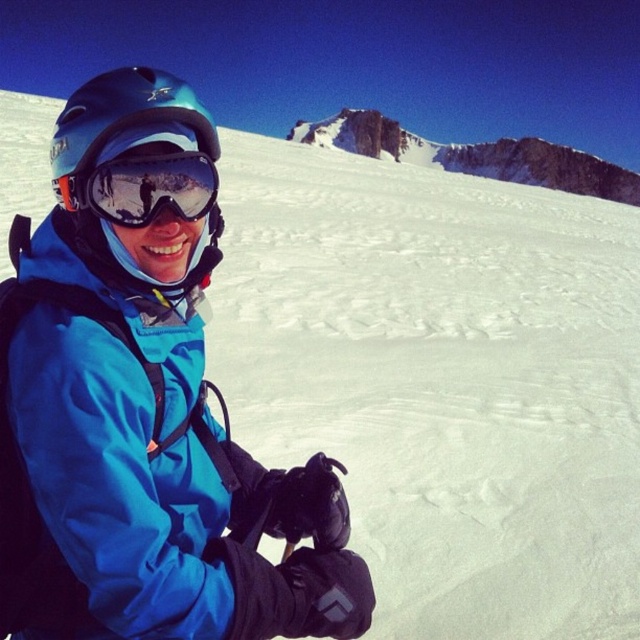
Which is in front, point (368, 132) or point (76, 179)?

Positioned in front is point (76, 179).

Is rugged stone mountain at upper center further to the viewer compared to glossy reflective goggles at center?

Yes, rugged stone mountain at upper center is behind glossy reflective goggles at center.

Is point (557, 173) closer to camera compared to point (83, 188)?

No, (557, 173) is behind (83, 188).

Where is `rugged stone mountain at upper center`? rugged stone mountain at upper center is located at coordinates (474, 156).

Can you confirm if rugged stone mountain at upper center is positioned to the left of matte blue helmet at left?

Incorrect, rugged stone mountain at upper center is not on the left side of matte blue helmet at left.

Between rugged stone mountain at upper center and matte blue helmet at left, which one is positioned lower?

matte blue helmet at left is lower down.

You are a GUI agent. You are given a task and a screenshot of the screen. Output one action in this format:
    pyautogui.click(x=<x>, y=<y>)
    Task: Click on the rugged stone mountain at upper center
    Image resolution: width=640 pixels, height=640 pixels.
    Given the screenshot: What is the action you would take?
    pyautogui.click(x=474, y=156)

Locate an element on the screen. The width and height of the screenshot is (640, 640). rugged stone mountain at upper center is located at coordinates (474, 156).

Is point (65, 188) more distant than point (99, 212)?

No, it is in front of (99, 212).

Measure the distance between matte blue helmet at left and glossy reflective goggles at center.

matte blue helmet at left is 29.06 inches away from glossy reflective goggles at center.

Measure the distance between point [77,170] and camera.

Point [77,170] and camera are 9.96 meters apart from each other.

This screenshot has height=640, width=640. Identify the location of matte blue helmet at left. (120, 122).